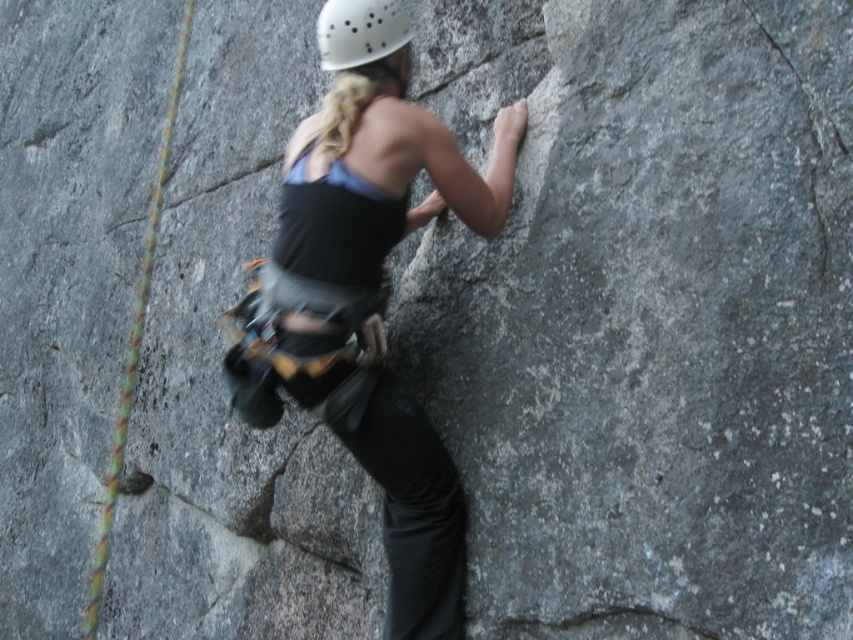
Does matte black tank top at center have a lesser width compared to yellow-green braided rope at left?

No.

Does matte black tank top at center come in front of yellow-green braided rope at left?

Yes, matte black tank top at center is in front of yellow-green braided rope at left.

Is point (426, 570) closer to camera compared to point (148, 280)?

Yes.

The height and width of the screenshot is (640, 853). In order to click on matte black tank top at center in this screenshot , I will do `click(374, 312)`.

Based on the photo, who is more forward, (183, 44) or (408, 17)?

Positioned in front is point (408, 17).

Which is above, yellow-green braided rope at left or white matte helmet at upper center?

white matte helmet at upper center

Which is in front, point (160, 188) or point (357, 3)?

Positioned in front is point (357, 3).

Where is `yellow-green braided rope at left`? The height and width of the screenshot is (640, 853). yellow-green braided rope at left is located at coordinates (134, 342).

Does matte black tank top at center appear under white matte helmet at upper center?

Correct, matte black tank top at center is located below white matte helmet at upper center.

Who is higher up, matte black tank top at center or white matte helmet at upper center?

Positioned higher is white matte helmet at upper center.

Where is `matte black tank top at center`? The width and height of the screenshot is (853, 640). matte black tank top at center is located at coordinates (374, 312).